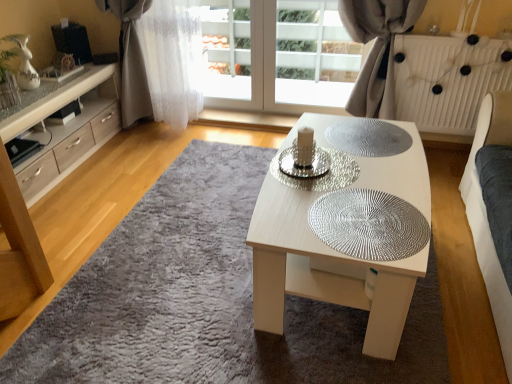
The image size is (512, 384). I want to click on vacant point above silver textured glass plate at center, positioned as the first glass plate in back-to-front order (from a real-world perspective), so click(x=369, y=136).